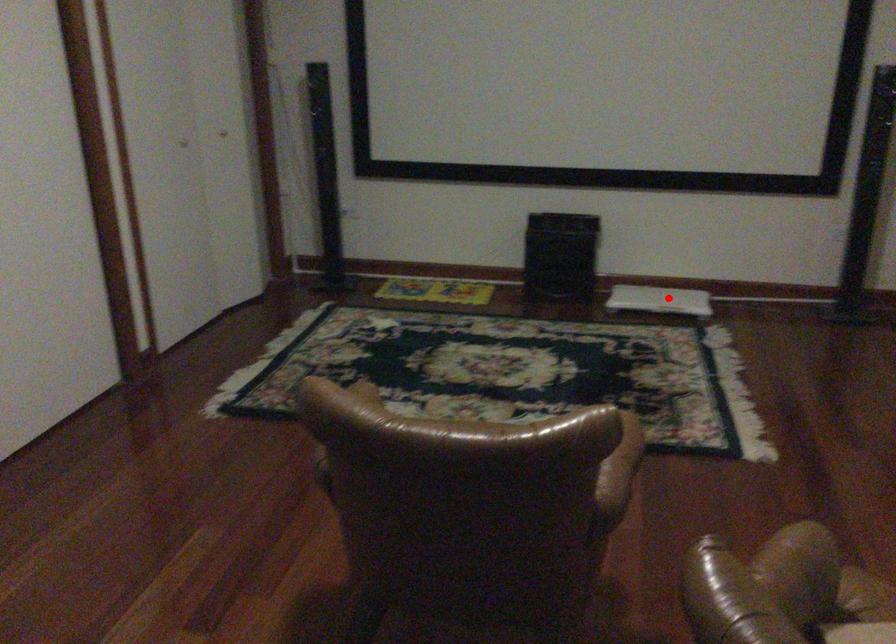
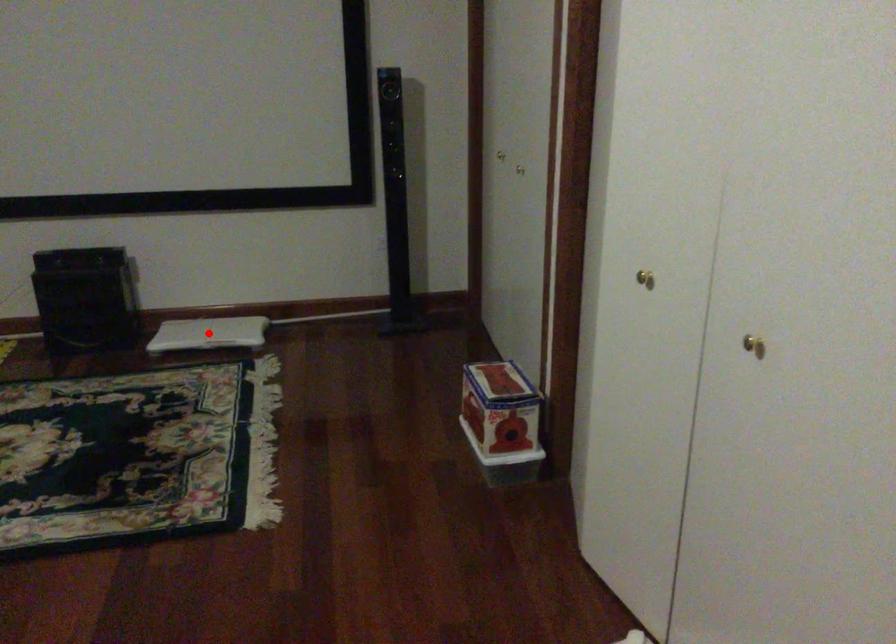
I am providing you with two images of the same scene from different viewpoints. A red point is marked on the first image and another point is marked on the second image. Is the red point in image1 aligned with the point shown in image2?

Yes